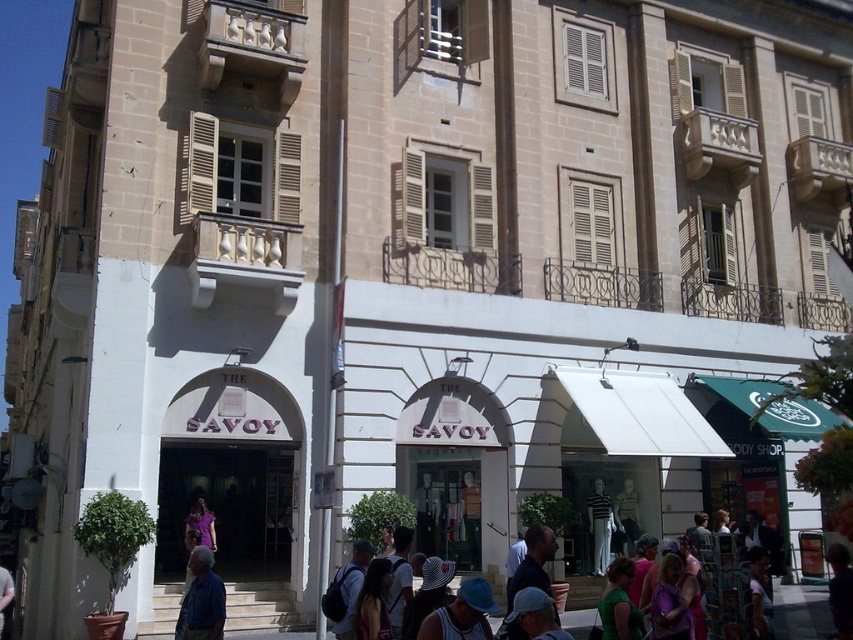
From the picture: You are standing on the bustling street scene in front of the multi story building. You see a matte blue hat at lower center and a blue fabric cap at center. Which one is positioned more to the left side?

The matte blue hat at lower center is positioned more to the left side than the blue fabric cap at center.

You are a tailor observing a street scene and notice two items made of blue fabric. The first is a blue fabric shirt at lower left, and the second is a blue fabric cap at center. Which of these two items takes up more space in the image?

The blue fabric cap at center takes up more space in the image than the blue fabric shirt at lower left because the blue fabric shirt at lower left occupies less space than blue fabric cap at center.